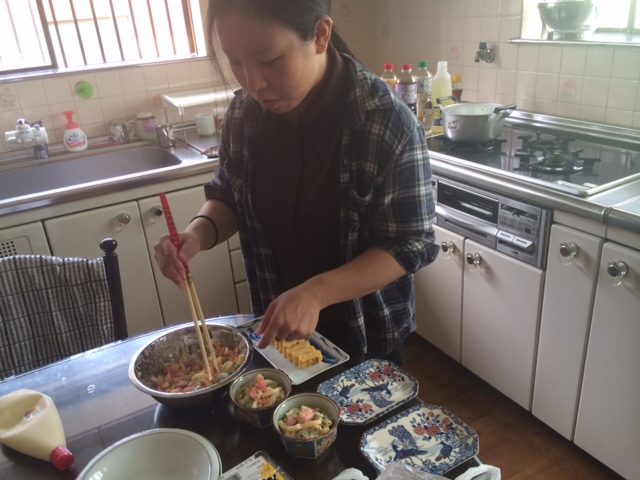
Identify the location of soap. Image resolution: width=640 pixels, height=480 pixels. (76, 137).